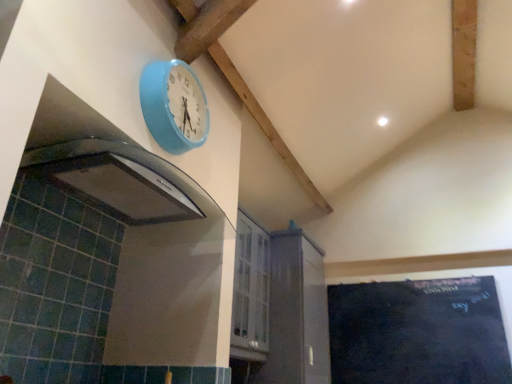
The image size is (512, 384). Describe the element at coordinates (418, 332) in the screenshot. I see `black chalkboard at lower right` at that location.

Measure the distance between point (x=307, y=267) and camera.

10.00 feet.

Find the location of a particular element. black chalkboard at lower right is located at coordinates (418, 332).

Considering the sizes of objects light blue plastic clock at upper center and black chalkboard at lower right in the image provided, who is thinner, light blue plastic clock at upper center or black chalkboard at lower right?

black chalkboard at lower right.

Does light blue plastic clock at upper center have a lesser height compared to black chalkboard at lower right?

Yes, light blue plastic clock at upper center is shorter than black chalkboard at lower right.

Who is bigger, light blue plastic clock at upper center or black chalkboard at lower right?

black chalkboard at lower right.

Can you tell me how much light blue plastic clock at upper center and black chalkboard at lower right differ in facing direction?

light blue plastic clock at upper center and black chalkboard at lower right are facing 90.6 degrees away from each other.

Who is taller, black chalkboard at lower right or light blue plastic clock at upper center?

Standing taller between the two is black chalkboard at lower right.

From a real-world perspective, is black chalkboard at lower right positioned over light blue plastic clock at upper center based on gravity?

Actually, black chalkboard at lower right is physically below light blue plastic clock at upper center in the real world.

How much distance is there between black chalkboard at lower right and light blue plastic clock at upper center?

7.73 feet.

In the image, is black chalkboard at lower right positioned in front of or behind light blue plastic clock at upper center?

In the image, black chalkboard at lower right appears behind light blue plastic clock at upper center.

At what (x,y) coordinates should I click in order to perform the action: click on cabinetry above the black chalkboard at lower right (from the image's perspective). Please return your answer as a coordinate pair (x, y). This screenshot has width=512, height=384. Looking at the image, I should click on (296, 313).

Between point (271, 284) and point (477, 362), which one is positioned behind?

Positioned behind is point (271, 284).

Which of these two, white glossy cabinet at center or black chalkboard at lower right, is wider?

With larger width is white glossy cabinet at center.

Considering the sizes of white glossy cabinet at center and light blue plastic clock at upper center in the image, is white glossy cabinet at center bigger or smaller than light blue plastic clock at upper center?

white glossy cabinet at center is bigger than light blue plastic clock at upper center.

From the image's perspective, which is below, white glossy cabinet at center or light blue plastic clock at upper center?

From the image's view, white glossy cabinet at center is below.

Relative to light blue plastic clock at upper center, is white glossy cabinet at center in front or behind?

Clearly, white glossy cabinet at center is behind light blue plastic clock at upper center.

In the scene shown: Considering the positions of objects white glossy cabinet at center and light blue plastic clock at upper center in the image provided, who is more to the left, white glossy cabinet at center or light blue plastic clock at upper center?

From the viewer's perspective, light blue plastic clock at upper center appears more on the left side.

From the image's perspective, is black chalkboard at lower right located beneath white glossy cabinet at center?

Yes, from the image's perspective, black chalkboard at lower right is beneath white glossy cabinet at center.

What's the angular difference between black chalkboard at lower right and white glossy cabinet at center's facing directions?

89.8 degrees.

Looking at this image, from a real-world perspective, is black chalkboard at lower right above or below white glossy cabinet at center?

Clearly, from a real-world perspective, black chalkboard at lower right is below white glossy cabinet at center.

Is black chalkboard at lower right wider than white glossy cabinet at center?

Incorrect, the width of black chalkboard at lower right does not surpass that of white glossy cabinet at center.

Is light blue plastic clock at upper center further to camera compared to white glossy cabinet at center?

No, light blue plastic clock at upper center is closer to the viewer.

Measure the distance between light blue plastic clock at upper center and white glossy cabinet at center.

They are 5.60 feet apart.

Considering the sizes of objects light blue plastic clock at upper center and white glossy cabinet at center in the image provided, who is taller, light blue plastic clock at upper center or white glossy cabinet at center?

With more height is white glossy cabinet at center.

Is light blue plastic clock at upper center wider or thinner than white glossy cabinet at center?

light blue plastic clock at upper center is thinner than white glossy cabinet at center.

Image resolution: width=512 pixels, height=384 pixels. In order to click on bulletin board below the light blue plastic clock at upper center (from a real-world perspective) in this screenshot , I will do `click(418, 332)`.

Locate an element on the screen. Image resolution: width=512 pixels, height=384 pixels. wall clock to the left of black chalkboard at lower right is located at coordinates (174, 106).

In the scene shown: Considering their positions, is black chalkboard at lower right positioned further to light blue plastic clock at upper center than white glossy cabinet at center?

Based on the image, black chalkboard at lower right appears to be further to light blue plastic clock at upper center.

Looking at the image, which one is located further to black chalkboard at lower right, white glossy cabinet at center or light blue plastic clock at upper center?

light blue plastic clock at upper center.

When comparing their distances from white glossy cabinet at center, does black chalkboard at lower right or light blue plastic clock at upper center seem closer?

black chalkboard at lower right lies closer to white glossy cabinet at center than the other object.

When comparing their distances from light blue plastic clock at upper center, does white glossy cabinet at center or black chalkboard at lower right seem closer?

Based on the image, white glossy cabinet at center appears to be nearer to light blue plastic clock at upper center.

From the picture: From the image, which object appears to be farther from white glossy cabinet at center, light blue plastic clock at upper center or black chalkboard at lower right?

Based on the image, light blue plastic clock at upper center appears to be further to white glossy cabinet at center.

When comparing their distances from black chalkboard at lower right, does light blue plastic clock at upper center or white glossy cabinet at center seem closer?

white glossy cabinet at center lies closer to black chalkboard at lower right than the other object.

You are a GUI agent. You are given a task and a screenshot of the screen. Output one action in this format:
    pyautogui.click(x=<x>, y=<y>)
    Task: Click on the cabinetry between light blue plastic clock at upper center and black chalkboard at lower right from top to bottom
    
    Given the screenshot: What is the action you would take?
    pyautogui.click(x=296, y=313)